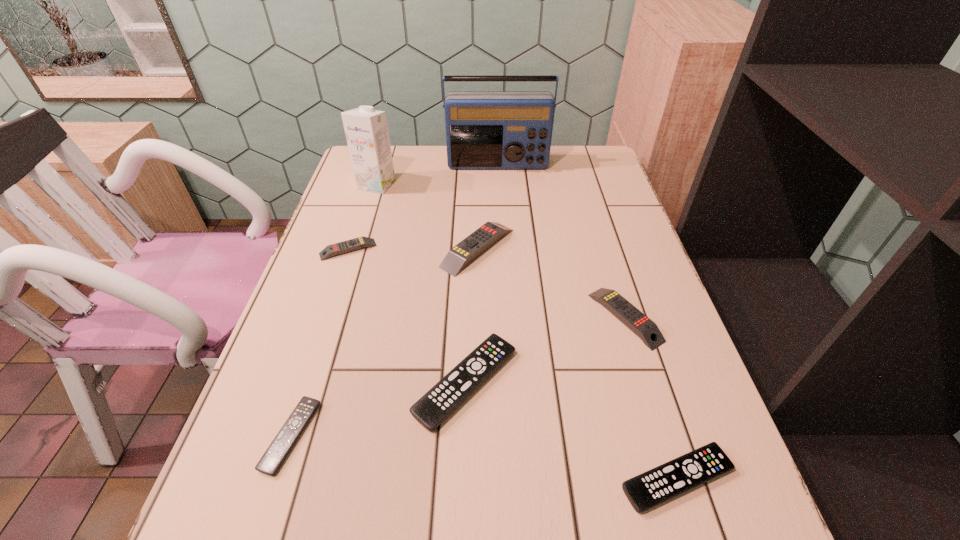
This screenshot has width=960, height=540. Find the location of `the rightmost black remote control`. the rightmost black remote control is located at coordinates pyautogui.click(x=662, y=483).

The image size is (960, 540). What are the coordinates of `the shortest remote control` in the screenshot? It's located at (272, 459).

Locate an element on the screen. The height and width of the screenshot is (540, 960). the smallest black remote control is located at coordinates (272, 459).

The height and width of the screenshot is (540, 960). Identify the location of vacant space positioned 0.310m on the front panel of the radio receiver. (501, 233).

What are the coordinates of `free space located on the right of the carton` in the screenshot? It's located at (433, 185).

The width and height of the screenshot is (960, 540). Identify the location of vacant space situated on the right of the sixth shortest object. (561, 248).

You are a GUI agent. You are given a task and a screenshot of the screen. Output one action in this format:
    pyautogui.click(x=<x>, y=<y>)
    Task: Click on the free space located on the front of the second smallest yellow remote control
    The height and width of the screenshot is (540, 960).
    Given the screenshot: What is the action you would take?
    tap(682, 499)

Image resolution: width=960 pixels, height=540 pixels. I want to click on free region located 0.320m on the right of the second black remote control from left to right, so click(x=681, y=382).

Locate an element on the screen. This screenshot has width=960, height=540. free space located on the back of the leftmost yellow remote control is located at coordinates (358, 219).

Find the location of `blank space located 0.260m on the back of the second smallest black remote control`. blank space located 0.260m on the back of the second smallest black remote control is located at coordinates (630, 329).